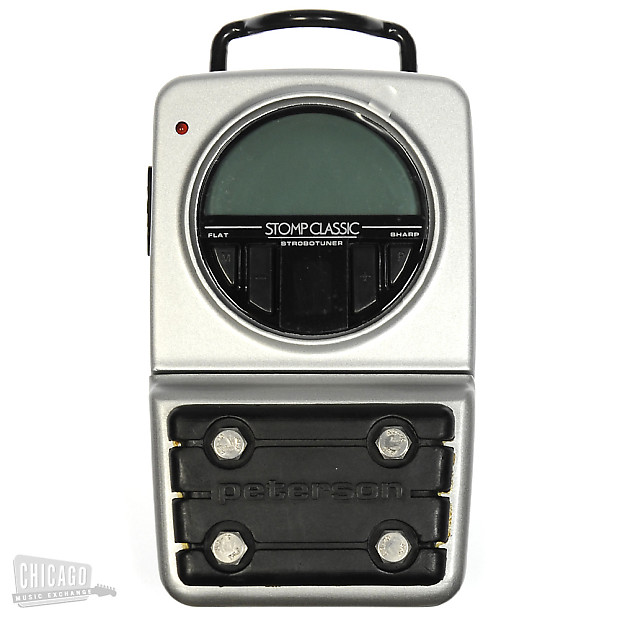
Find the location of a particular element. The height and width of the screenshot is (620, 620). power light is located at coordinates (180, 126).